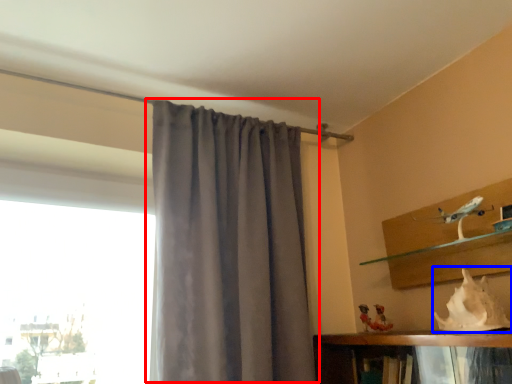
Question: Which point is further to the camera, curtain (highlighted by a red box) or animal (highlighted by a blue box)?

Choices:
 (A) curtain
 (B) animal

Answer: (A)